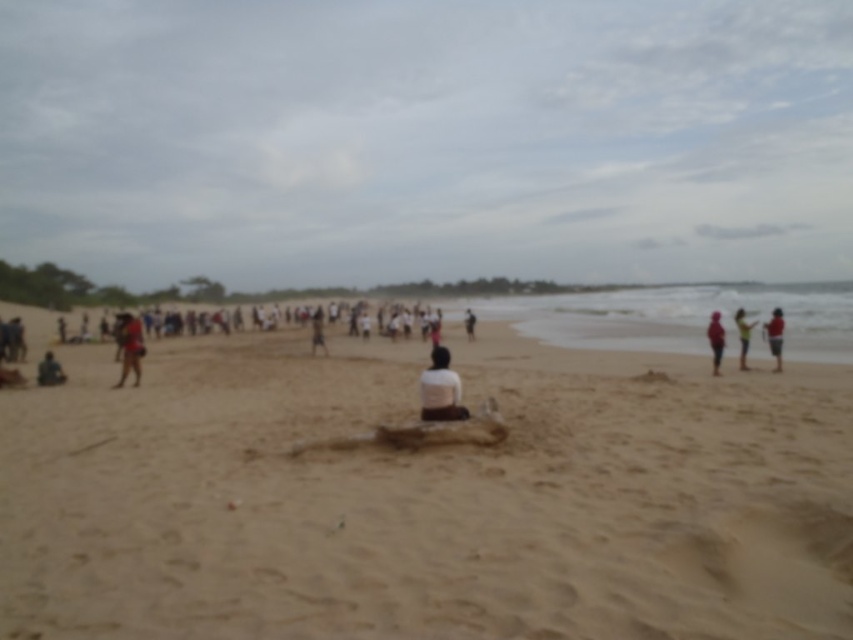
Question: Which point is farther to the camera?

Choices:
 (A) (328, 353)
 (B) (717, 339)

Answer: (A)

Question: Does matte brown backpack at left come behind white cotton shirt at right?

Choices:
 (A) no
 (B) yes

Answer: (A)

Question: Can you confirm if pink fabric at right is positioned to the left of dark brown leather bag at lower left?

Choices:
 (A) yes
 (B) no

Answer: (B)

Question: Which point is closer to the camera?

Choices:
 (A) (474, 321)
 (B) (434, 406)
 (C) (312, 316)

Answer: (B)

Question: Is dark brown leather bag at lower left wider than dark gray fabric person at center?

Choices:
 (A) no
 (B) yes

Answer: (B)

Question: Which object appears closest to the camera in this image?

Choices:
 (A) dark gray fabric person at center
 (B) dark brown leather bag at lower left
 (C) pink fabric at right
 (D) matte brown backpack at left

Answer: (C)